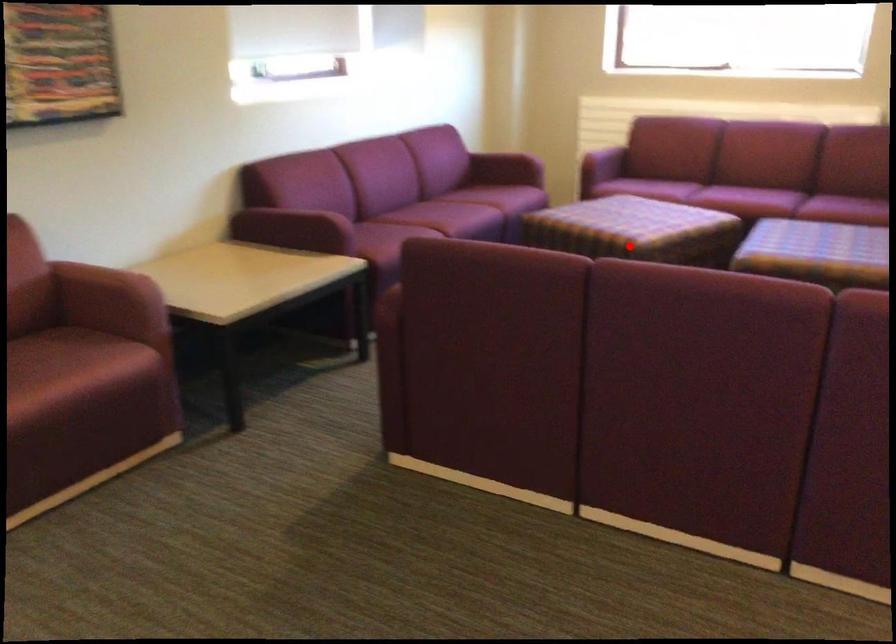
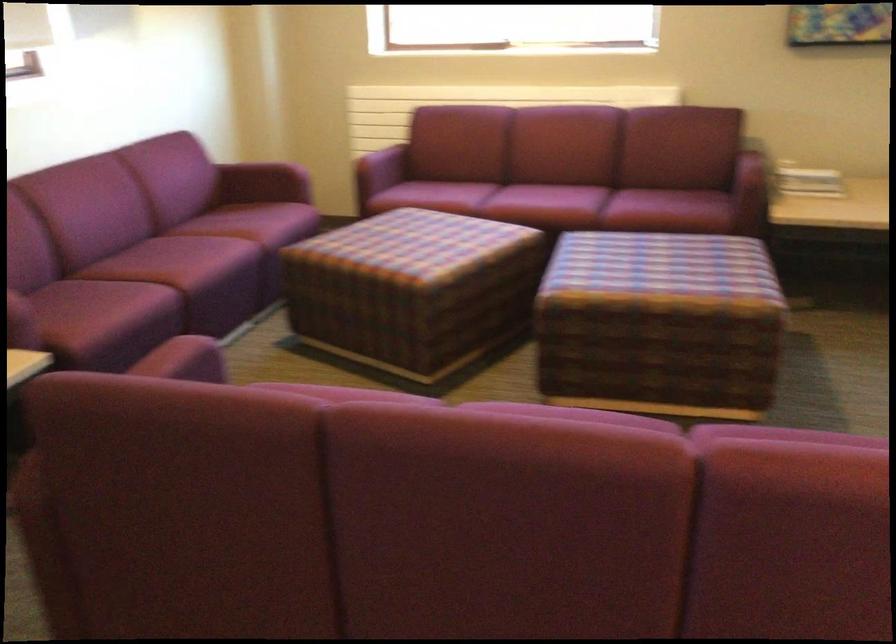
The point at the highlighted location is marked in the first image. Where is the corresponding point in the second image?

(412, 289)